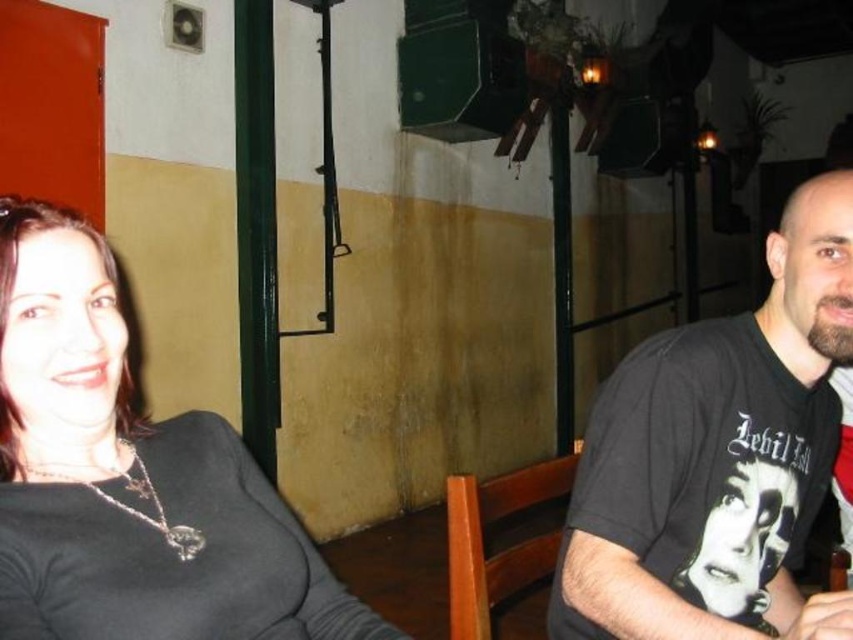
This screenshot has height=640, width=853. I want to click on matte black shirt at left, so click(x=129, y=477).

Is matte black shirt at left thinner than black cotton t-shirt at right?

Correct, matte black shirt at left's width is less than black cotton t-shirt at right's.

Is point (111, 634) more distant than point (677, 593)?

No, it is in front of (677, 593).

At what (x,y) coordinates should I click in order to perform the action: click on matte black shirt at left. Please return your answer as a coordinate pair (x, y). The width and height of the screenshot is (853, 640). Looking at the image, I should click on (129, 477).